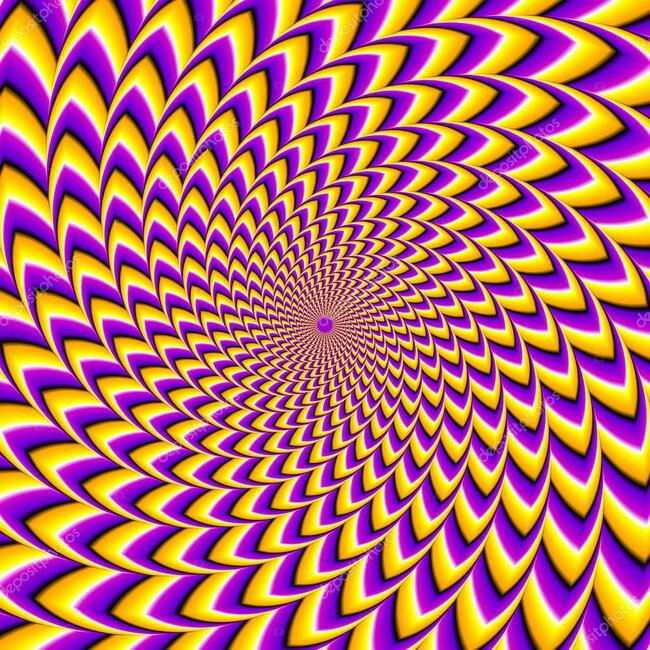
At what (x,y) coordinates should I click in order to perform the action: click on artwork. Please return your answer as a coordinate pair (x, y). Looking at the image, I should click on (234, 589).